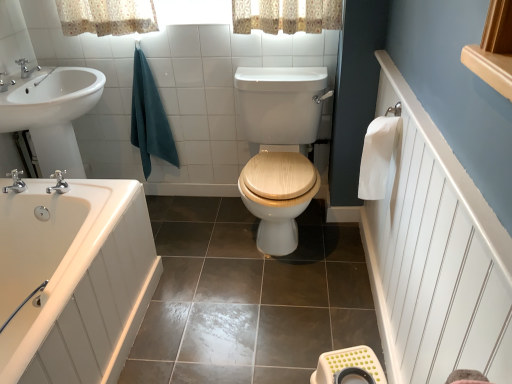
This screenshot has width=512, height=384. Identify the location of free space in front of wooden at center. (270, 311).